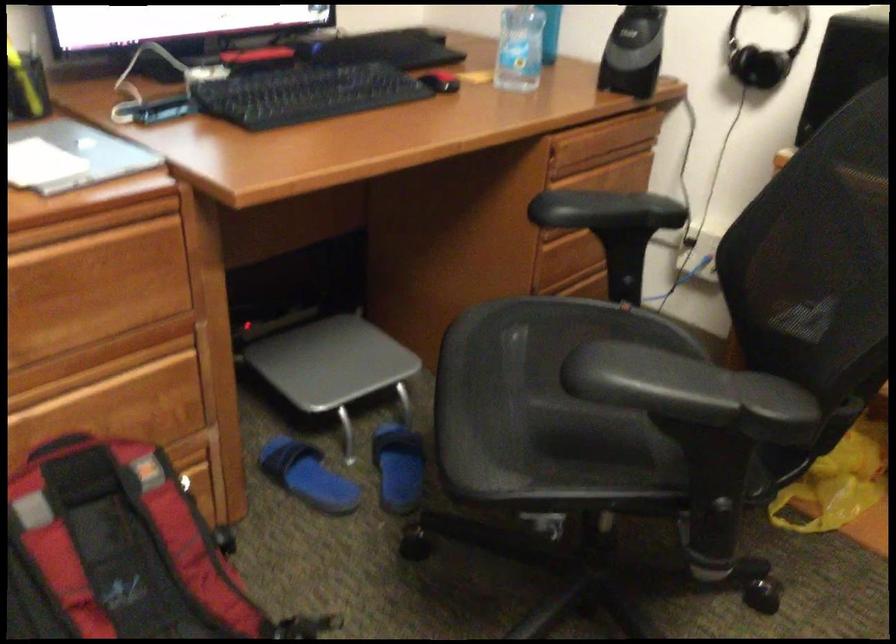
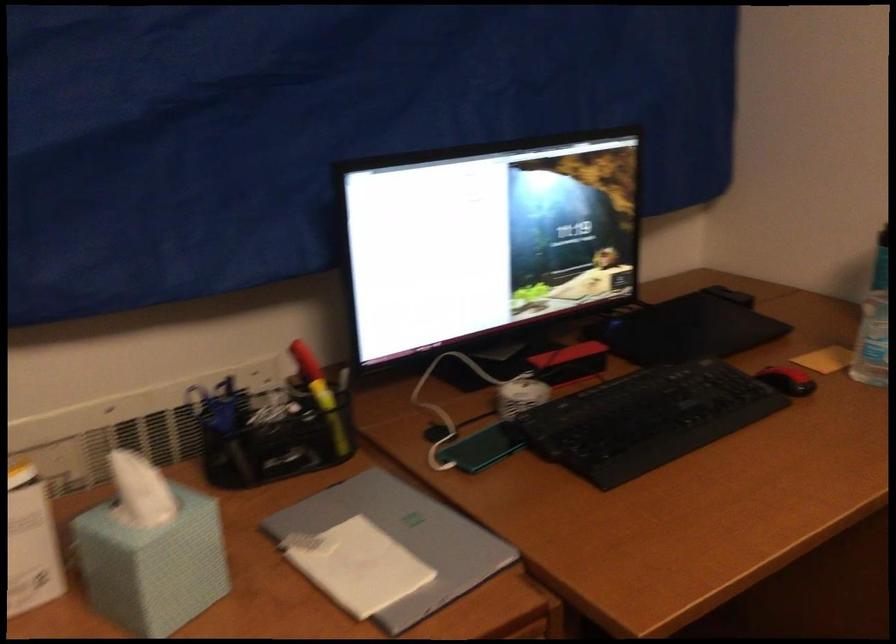
Question: The first image is from the beginning of the video and the second image is from the end. How did the camera likely rotate when shooting the video?

Choices:
 (A) Left
 (B) Right
 (C) Up
 (D) Down

Answer: (A)